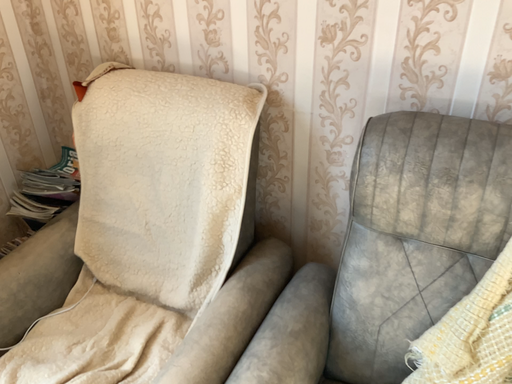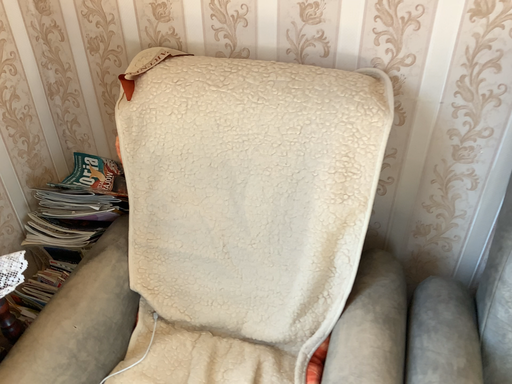
Question: How did the camera likely rotate when shooting the video?

Choices:
 (A) rotated left
 (B) rotated right

Answer: (B)